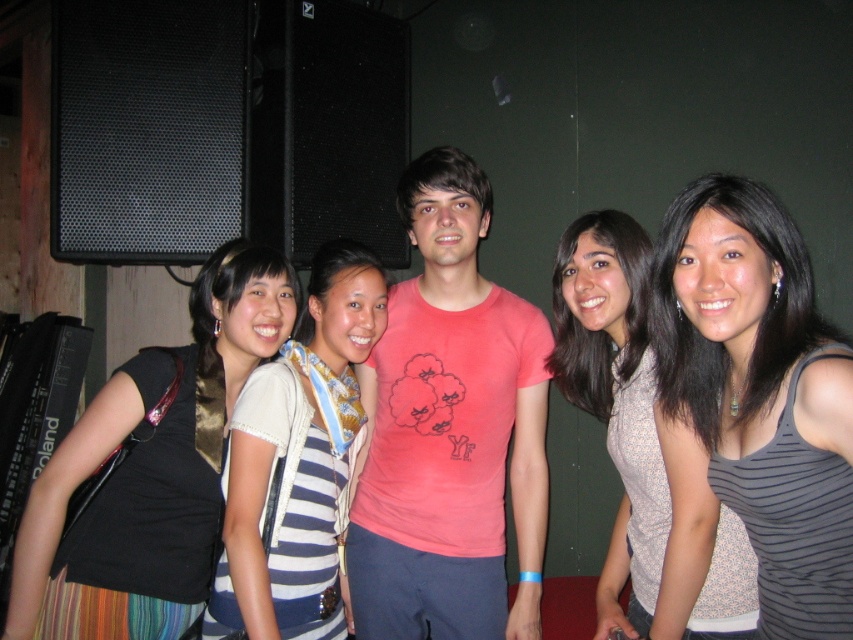
Question: Considering the relative positions of gray striped tank top at center and patterned fabric top at center in the image provided, where is gray striped tank top at center located with respect to patterned fabric top at center?

Choices:
 (A) below
 (B) above

Answer: (B)

Question: Which of these objects is positioned closest to the black fabric at left?

Choices:
 (A) matte pink t-shirt at center
 (B) patterned fabric top at center

Answer: (A)

Question: Is matte pink t-shirt at center bigger than patterned fabric top at center?

Choices:
 (A) yes
 (B) no

Answer: (B)

Question: Can you confirm if gray striped tank top at center is thinner than black fabric at left?

Choices:
 (A) yes
 (B) no

Answer: (A)

Question: Estimate the real-world distances between objects in this image. Which object is closer to the gray striped tank top at center?

Choices:
 (A) black fabric at left
 (B) striped fabric dress at center
 (C) matte pink t-shirt at center
 (D) patterned fabric top at center

Answer: (D)

Question: Which of the following is the closest to the observer?

Choices:
 (A) (780, 224)
 (B) (221, 458)

Answer: (A)